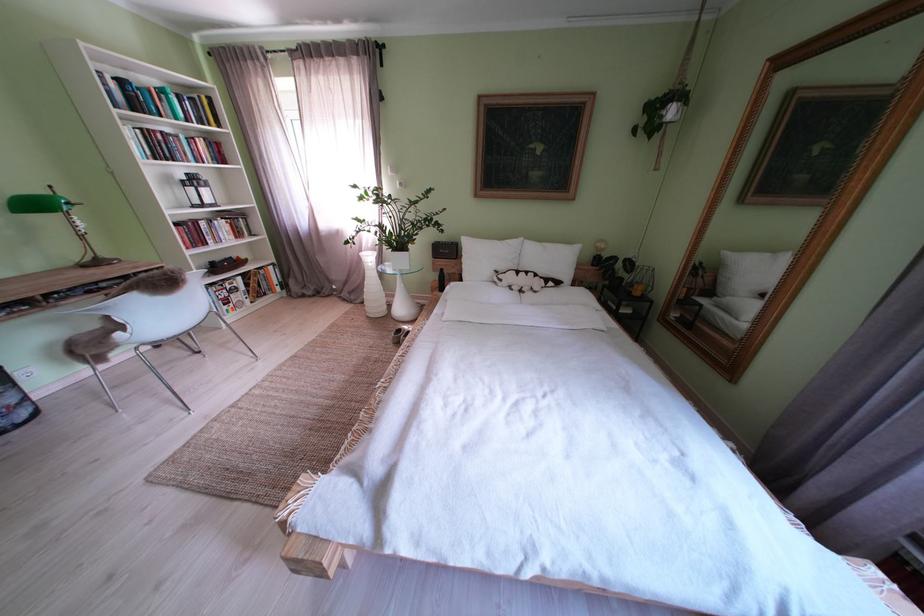
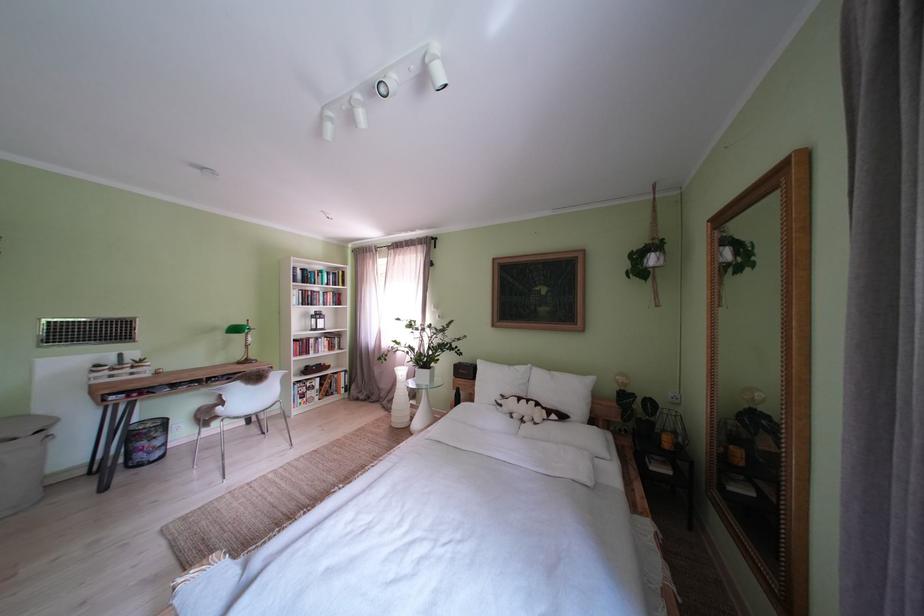
In the second image, find the point that corresponds to pixel 512 285 in the first image.

(512, 411)